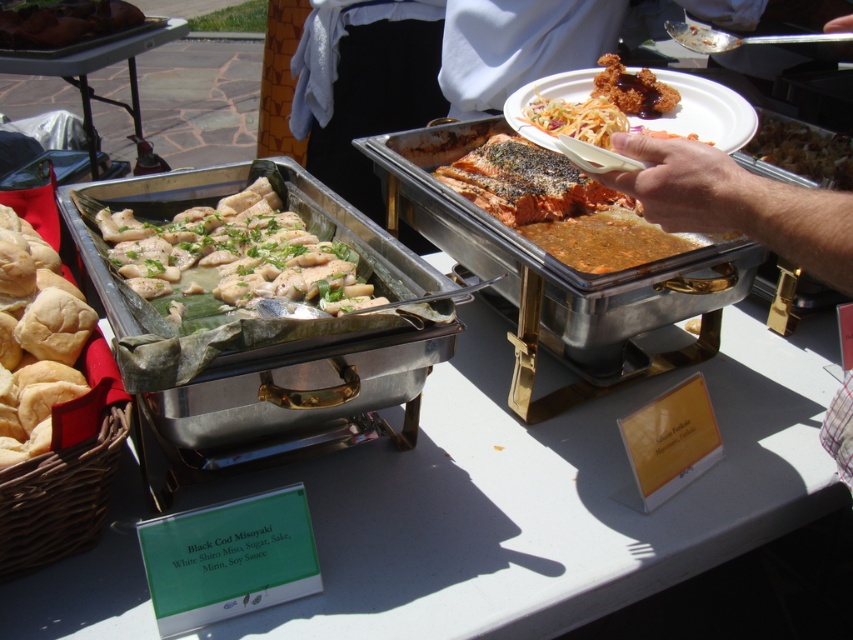
You are at an outdoor event and want to take a photo of both the shiny brown salmon at center and the savory salmon at center. Which one should you focus on first to ensure both are in the frame?

You should focus on the shiny brown salmon at center first since it is closer to you than the savory salmon at center, allowing both to be in the frame when adjusted properly.

You are at a buffet and want to take a plate of the brown crispy rice at center and the matte brown bread at left. Which one should you grab first to reach them both efficiently?

The matte brown bread at left is positioned on the left side of the brown crispy rice at center, so you should grab the matte brown bread at left first to reach both efficiently.